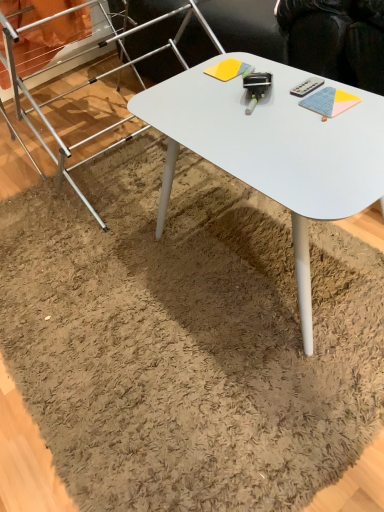
Measure the distance between textured blue notepad at upper right, which is the 1th notepad in front-to-back order, and camera.

textured blue notepad at upper right, which is the 1th notepad in front-to-back order, is 35.83 inches from camera.

Where is `white matte desk at center`? white matte desk at center is located at coordinates (274, 149).

At what (x,y) coordinates should I click in order to perform the action: click on ladder on the left of textured blue notepad at upper right, the second notepad in the top-to-bottom sequence. Please return your answer as a coordinate pair (x, y). Image resolution: width=384 pixels, height=512 pixels. Looking at the image, I should click on (79, 146).

Which is more to the right, silver metallic ladder at upper left or textured blue notepad at upper right, which is the 1th notepad in front-to-back order?

textured blue notepad at upper right, which is the 1th notepad in front-to-back order, is more to the right.

Is silver metallic ladder at upper left aimed at textured blue notepad at upper right, marked as the 2th notepad in a left-to-right arrangement?

No, silver metallic ladder at upper left is not turned towards textured blue notepad at upper right, marked as the 2th notepad in a left-to-right arrangement.

Considering the relative sizes of textured blue notepad at upper right, which is the 1th notepad in front-to-back order, and white matte desk at center in the image provided, is textured blue notepad at upper right, which is the 1th notepad in front-to-back order, shorter than white matte desk at center?

Yes.

Is textured blue notepad at upper right, the 1th notepad when ordered from bottom to top, wider than white matte desk at center?

In fact, textured blue notepad at upper right, the 1th notepad when ordered from bottom to top, might be narrower than white matte desk at center.

Is point (333, 90) behind point (223, 136)?

Yes, it is.

Measure the distance from textured blue notepad at upper right, the second notepad in the top-to-bottom sequence, to white matte desk at center.

textured blue notepad at upper right, the second notepad in the top-to-bottom sequence, and white matte desk at center are 8.47 inches apart from each other.

Considering the relative sizes of white matte desk at center and black plastic remote control at upper right in the image provided, is white matte desk at center thinner than black plastic remote control at upper right?

No.

Image resolution: width=384 pixels, height=512 pixels. I want to click on remote control that is above the white matte desk at center (from a real-world perspective), so (307, 87).

Between white matte desk at center and black plastic remote control at upper right, which one has smaller size?

With smaller size is black plastic remote control at upper right.

Which is in front, point (233, 70) or point (190, 1)?

The point (233, 70) is more forward.

Is yellow matte notepad at center, the second notepad in the right-to-left sequence, not close to silver metallic ladder at upper left?

No.

Which object is closer to the camera taking this photo, yellow matte notepad at center, arranged as the 2th notepad when ordered from the bottom, or silver metallic ladder at upper left?

silver metallic ladder at upper left is more forward.

Looking at this image, who is more distant, yellow matte notepad at center, arranged as the 2th notepad when ordered from the bottom, or black plastic remote control at upper right?

yellow matte notepad at center, arranged as the 2th notepad when ordered from the bottom.

Is yellow matte notepad at center, which is counted as the 1th notepad, starting from the left, at the left side of black plastic remote control at upper right?

Correct, you'll find yellow matte notepad at center, which is counted as the 1th notepad, starting from the left, to the left of black plastic remote control at upper right.

Considering the sizes of objects yellow matte notepad at center, marked as the first notepad in a top-to-bottom arrangement, and black plastic remote control at upper right in the image provided, who is thinner, yellow matte notepad at center, marked as the first notepad in a top-to-bottom arrangement, or black plastic remote control at upper right?

black plastic remote control at upper right.

Considering the relative sizes of yellow matte notepad at center, the first notepad when ordered from back to front, and black plastic remote control at upper right in the image provided, is yellow matte notepad at center, the first notepad when ordered from back to front, shorter than black plastic remote control at upper right?

No, yellow matte notepad at center, the first notepad when ordered from back to front, is not shorter than black plastic remote control at upper right.

Considering the sizes of textured blue notepad at upper right, acting as the second notepad starting from the back, and silver metallic ladder at upper left in the image, is textured blue notepad at upper right, acting as the second notepad starting from the back, bigger or smaller than silver metallic ladder at upper left?

textured blue notepad at upper right, acting as the second notepad starting from the back, is smaller than silver metallic ladder at upper left.

Considering the positions of point (345, 95) and point (173, 49), is point (345, 95) closer or farther from the camera than point (173, 49)?

Point (345, 95) is closer to the camera than point (173, 49).

Is textured blue notepad at upper right, acting as the second notepad starting from the back, taller or shorter than silver metallic ladder at upper left?

In the image, textured blue notepad at upper right, acting as the second notepad starting from the back, appears to be shorter than silver metallic ladder at upper left.

Does textured blue notepad at upper right, the 1th notepad when ordered from bottom to top, have a lesser width compared to silver metallic ladder at upper left?

Yes, textured blue notepad at upper right, the 1th notepad when ordered from bottom to top, is thinner than silver metallic ladder at upper left.

From the image's perspective, who appears lower, black plastic remote control at upper right or silver metallic ladder at upper left?

black plastic remote control at upper right is shown below in the image.

Does point (297, 89) come in front of point (204, 22)?

Yes, it is in front of point (204, 22).

What's the angular difference between black plastic remote control at upper right and silver metallic ladder at upper left's facing directions?

0.00106 degrees.

Does black plastic remote control at upper right turn towards silver metallic ladder at upper left?

No, black plastic remote control at upper right does not turn towards silver metallic ladder at upper left.

Where is `the 2nd notepad above the silver metallic ladder at upper left (from a real-world perspective)`? The width and height of the screenshot is (384, 512). the 2nd notepad above the silver metallic ladder at upper left (from a real-world perspective) is located at coordinates (329, 102).

Identify the location of desk on the left of textured blue notepad at upper right, the second notepad in the top-to-bottom sequence. This screenshot has width=384, height=512. (274, 149).

Estimate the real-world distances between objects in this image. Which object is closer to silver metallic ladder at upper left, textured blue notepad at upper right, which is the 1th notepad in front-to-back order, or black plastic remote control at upper right?

The object closer to silver metallic ladder at upper left is black plastic remote control at upper right.

Based on their spatial positions, is black plastic remote control at upper right or silver metallic ladder at upper left further from white matte desk at center?

silver metallic ladder at upper left.

When comparing their distances from white matte desk at center, does textured blue notepad at upper right, acting as the second notepad starting from the back, or silver metallic ladder at upper left seem further?

silver metallic ladder at upper left.

Estimate the real-world distances between objects in this image. Which object is further from black plastic remote control at upper right, yellow matte notepad at center, which is counted as the 1th notepad, starting from the left, or textured blue notepad at upper right, which is the 1th notepad in front-to-back order?

yellow matte notepad at center, which is counted as the 1th notepad, starting from the left, is positioned further to the anchor black plastic remote control at upper right.

From the image, which object appears to be farther from white matte desk at center, black plastic remote control at upper right or yellow matte notepad at center, the first notepad when ordered from back to front?

The object further to white matte desk at center is yellow matte notepad at center, the first notepad when ordered from back to front.

Which object lies nearer to the anchor point black plastic remote control at upper right, white matte desk at center or silver metallic ladder at upper left?

Among the two, white matte desk at center is located nearer to black plastic remote control at upper right.

Which object lies nearer to the anchor point black plastic remote control at upper right, textured blue notepad at upper right, which is the 1th notepad in front-to-back order, or silver metallic ladder at upper left?

textured blue notepad at upper right, which is the 1th notepad in front-to-back order, is positioned closer to the anchor black plastic remote control at upper right.

From the image, which object appears to be nearer to textured blue notepad at upper right, acting as the first notepad starting from the right, silver metallic ladder at upper left or white matte desk at center?

white matte desk at center.

Locate an element on the screen. This screenshot has height=512, width=384. desk between silver metallic ladder at upper left and black plastic remote control at upper right from left to right is located at coordinates (274, 149).

The image size is (384, 512). In order to click on notepad between silver metallic ladder at upper left and textured blue notepad at upper right, marked as the 2th notepad in a left-to-right arrangement, in the horizontal direction in this screenshot , I will do [x=229, y=69].

This screenshot has width=384, height=512. I want to click on desk between silver metallic ladder at upper left and textured blue notepad at upper right, which is the 1th notepad in front-to-back order, in the horizontal direction, so click(274, 149).

Locate an element on the screen. This screenshot has height=512, width=384. notepad positioned between white matte desk at center and black plastic remote control at upper right from near to far is located at coordinates (329, 102).